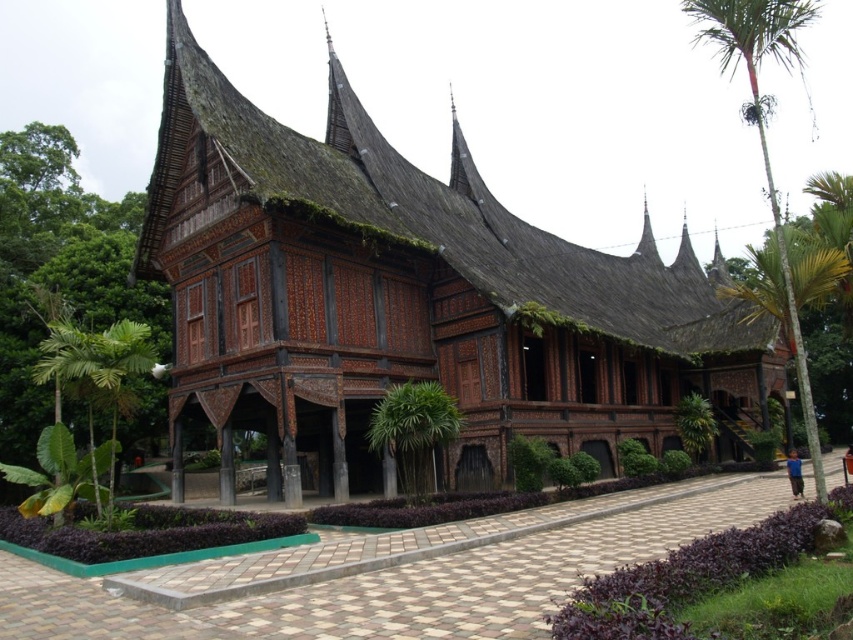
Consider the image. You are standing in front of the dark brown wood house at center and the green leafy palm tree at center. Which one is taller?

The dark brown wood house at center is taller than the green leafy palm tree at center.

You are standing in front of the traditional wooden structure and want to take a photo that includes both the green leafy palm tree at left and the intricate carvings on the roof. Based on their positions, will the palm tree be to the left or right of the carvings in the photo?

The green leafy palm tree at left is located at point [99,371], so in the photo, the palm tree will be to the left of the carvings on the roof.

You are standing in a field and see the dark brown wood house at center in the distance. If you want to take a closer look, how many steps would you need to take to reach it if each step covers about 0.75 meters?

The dark brown wood house at center is 57.24 meters away. Dividing the distance by the step length of 0.75 meters gives 57.24 divided by 0.75 equals 76.32 steps. Since you can only take whole steps, you would need to take approximately 76 steps to reach the dark brown wood house at center.